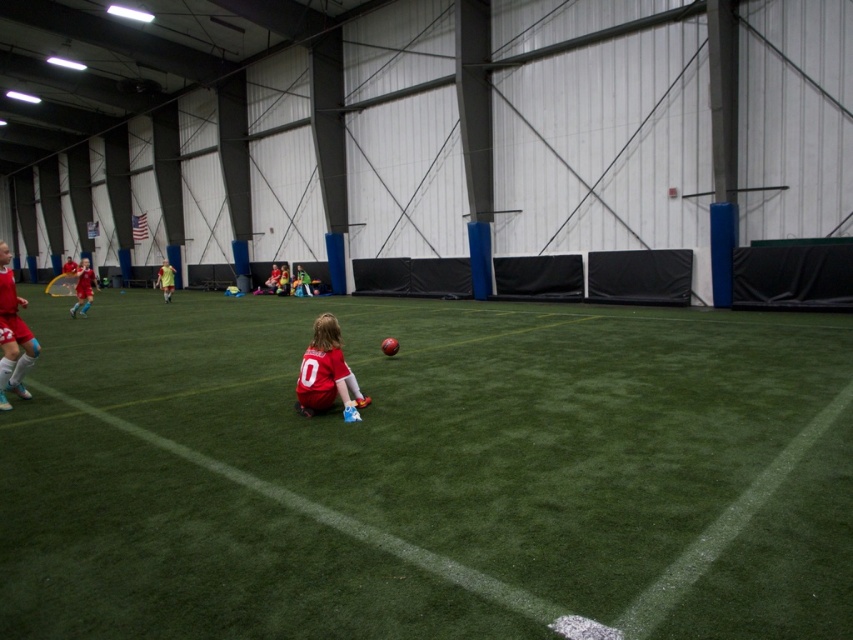
Does green artificial turf at center have a lesser width compared to matte red jersey at center?

Incorrect, green artificial turf at center's width is not less than matte red jersey at center's.

Is point (473, 376) positioned after point (346, 406)?

Yes, point (473, 376) is behind point (346, 406).

The width and height of the screenshot is (853, 640). I want to click on green artificial turf at center, so pos(425,472).

Does point (321, 362) come closer to viewer compared to point (90, 276)?

That is True.

Between matte red jersey at center and matte red soccer jersey at upper left, which one is positioned lower?

Positioned lower is matte red jersey at center.

Is point (346, 419) farther from viewer compared to point (79, 300)?

No, (346, 419) is in front of (79, 300).

Image resolution: width=853 pixels, height=640 pixels. What are the coordinates of `matte red jersey at center` in the screenshot? It's located at (326, 372).

Is green artificial turf at center positioned before matte red soccer jersey at upper left?

That is True.

Does green artificial turf at center have a lesser width compared to matte red soccer jersey at upper left?

No.

What are the coordinates of `green artificial turf at center` in the screenshot? It's located at (425, 472).